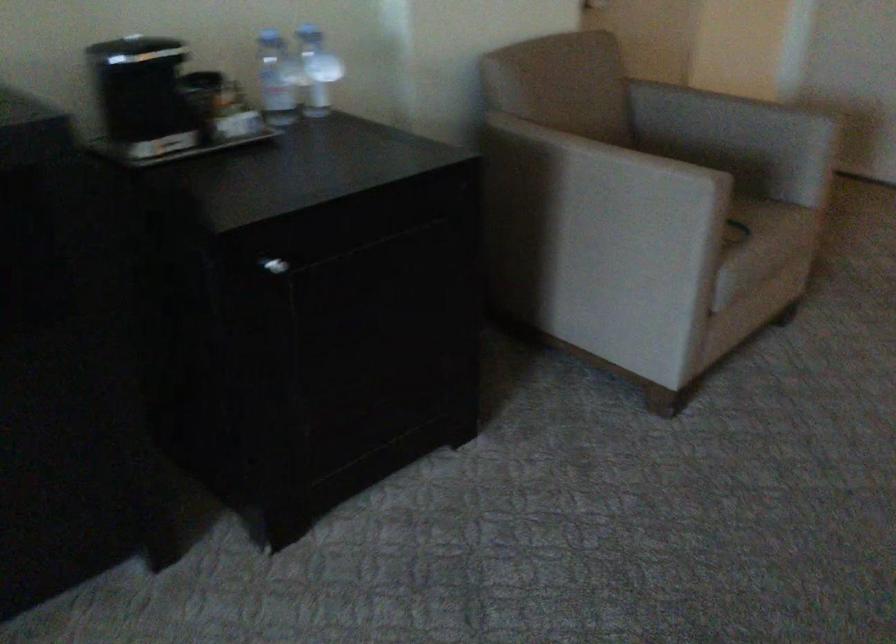
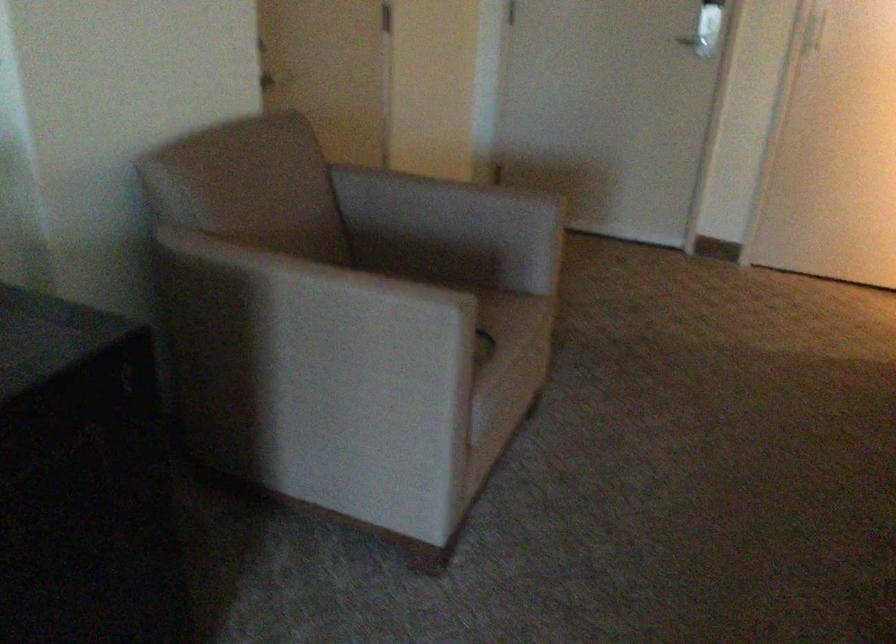
Where in the second image is the point corresponding to [767,234] from the first image?

(513, 345)